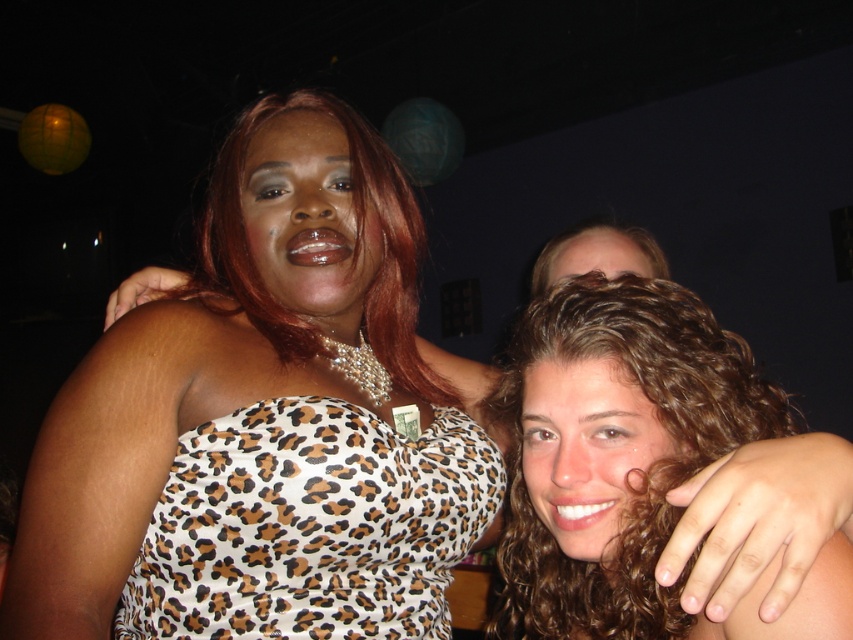
Question: Which point is closer to the camera?

Choices:
 (A) leopard print fabric dress at center
 (B) smooth skin face at upper center

Answer: (A)

Question: Which object appears farthest from the camera in this image?

Choices:
 (A) leopard print fabric dress at center
 (B) matte leopard print top at center
 (C) smooth skin face at upper center
 (D) curly hair at center

Answer: (C)

Question: In this image, where is curly hair at center located relative to smooth skin face at upper center?

Choices:
 (A) left
 (B) right

Answer: (A)

Question: Which of the following is the closest to the observer?

Choices:
 (A) (299, 300)
 (B) (576, 260)
 (C) (549, 516)

Answer: (C)

Question: Is leopard print fabric dress at center below matte leopard print top at center?

Choices:
 (A) no
 (B) yes

Answer: (B)

Question: Does leopard print fabric dress at center have a greater width compared to smooth skin face at upper center?

Choices:
 (A) yes
 (B) no

Answer: (A)